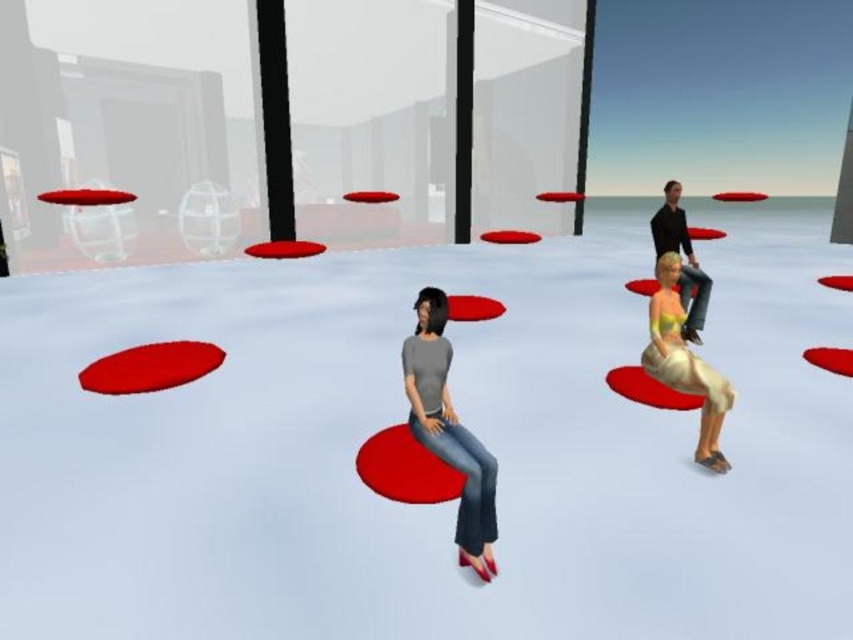
You are an avatar in the virtual environment and need to sit on the beige fabric cushion at right. Considering the size of your avatar, which is designed to fit the matte black shirt at upper right, will the cushion be large enough for you to sit comfortably?

The beige fabric cushion at right has a smaller width than the matte black shirt at upper right. Since the avatar is designed to fit the matte black shirt at upper right, the cushion may not be large enough for comfortable seating.

You are an avatar in this virtual environment and need to determine the relative height of the two avatars wearing the matte gray shirt at center and the matte black shirt at upper right. Which avatar is shorter?

The matte gray shirt at center is shorter than the matte black shirt at upper right.

You are an avatar in the virtual environment and want to sit on the beige fabric cushion at right. Which direction should you move from the matte gray shirt at center to reach it?

The beige fabric cushion at right is to the right of the matte gray shirt at center, so you should move to the right from the matte gray shirt at center to reach it.